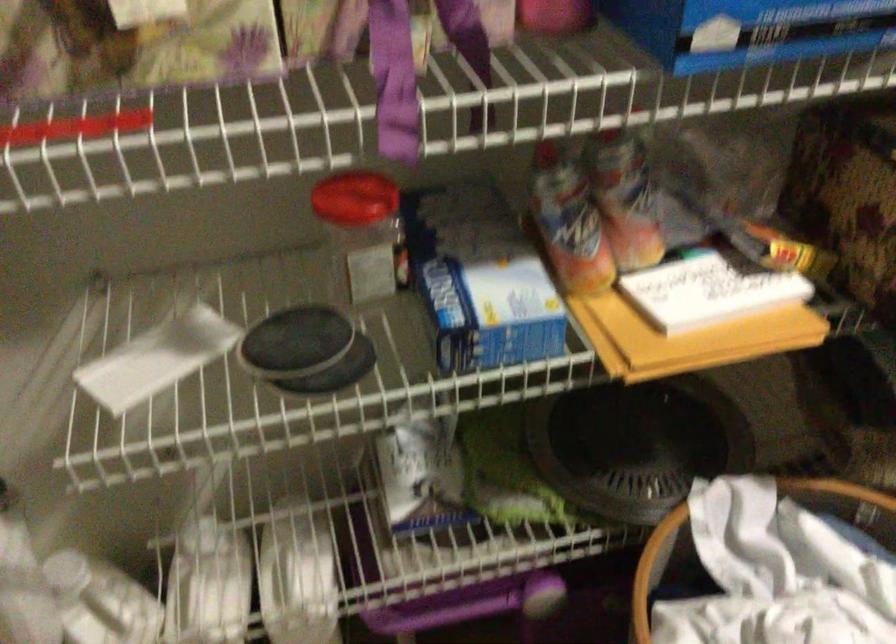
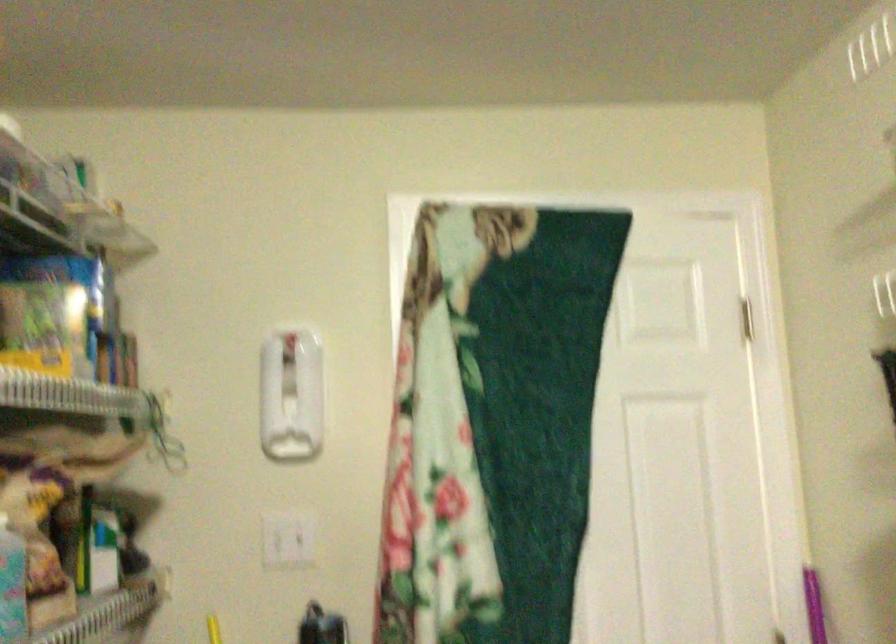
Question: The camera is either moving clockwise (left) or counter-clockwise (right) around the object. The first image is from the beginning of the video and the second image is from the end. Is the camera moving left or right when shooting the video?

Choices:
 (A) Left
 (B) Right

Answer: (B)